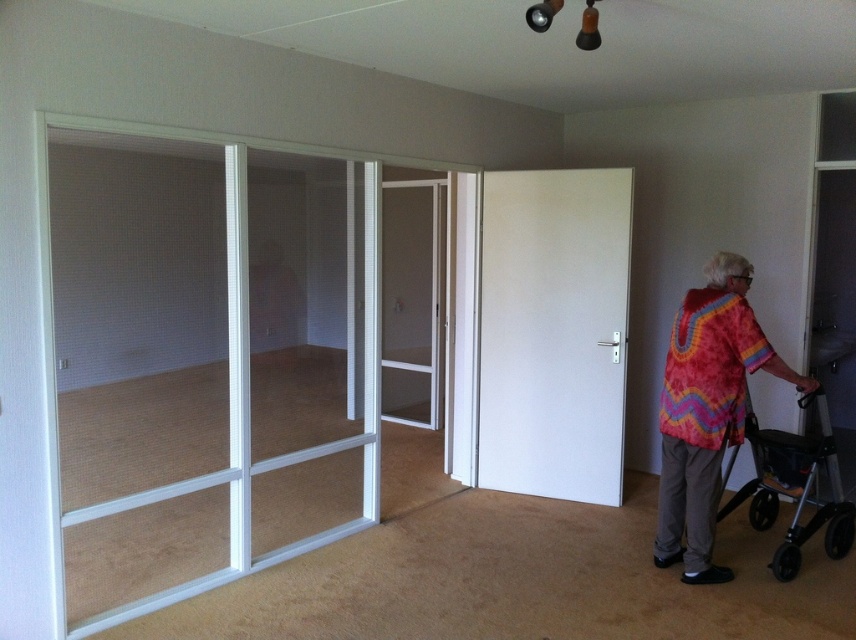
Is white matte door at center behind silver metallic walker at lower right?

Yes.

Which is behind, point (535, 372) or point (774, 493)?

Positioned behind is point (535, 372).

This screenshot has height=640, width=856. Find the location of `white matte door at center`. white matte door at center is located at coordinates (553, 332).

Who is taller, clear glass door at left or silver metallic walker at lower right?

Standing taller between the two is clear glass door at left.

Is clear glass door at left taller than silver metallic walker at lower right?

Yes, clear glass door at left is taller than silver metallic walker at lower right.

Who is more distant from viewer, (173, 259) or (794, 550)?

The point (794, 550) is behind.

Locate an element on the screen. clear glass door at left is located at coordinates (201, 358).

Which is below, multicolored knitted sweater at right or silver metallic walker at lower right?

silver metallic walker at lower right is lower down.

Can you confirm if multicolored knitted sweater at right is bigger than silver metallic walker at lower right?

Yes.

Is point (690, 564) more distant than point (786, 568)?

No.

Identify the location of multicolored knitted sweater at right. (706, 410).